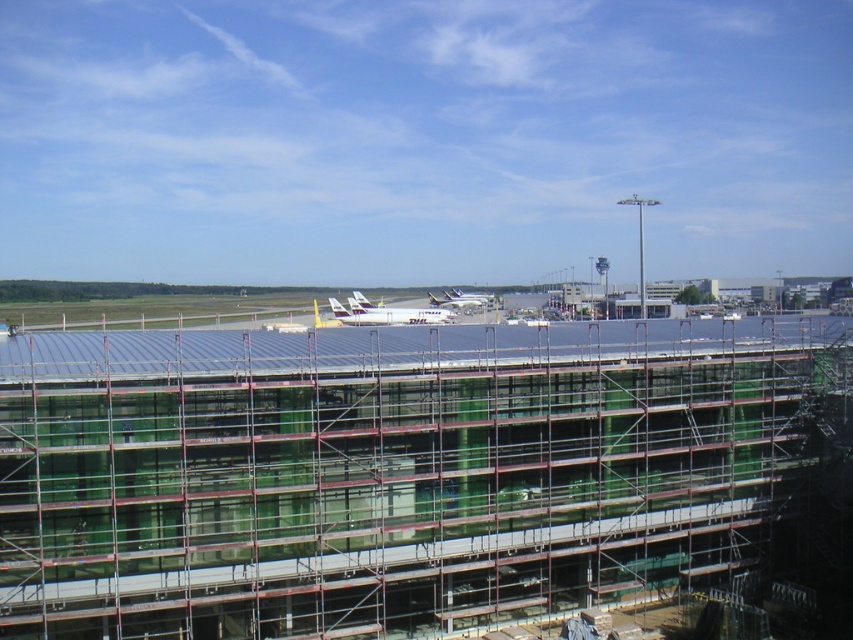
Question: Does green glass building at center have a smaller size compared to white matte airplane at center?

Choices:
 (A) no
 (B) yes

Answer: (A)

Question: Can you confirm if white matte airplane at center is positioned above white glossy airplane at center?

Choices:
 (A) yes
 (B) no

Answer: (B)

Question: Estimate the real-world distances between objects in this image. Which object is farther from the green glass building at center?

Choices:
 (A) white glossy airplane at center
 (B) white matte airplane at center

Answer: (A)

Question: Does green glass building at center have a smaller size compared to white glossy airplane at center?

Choices:
 (A) no
 (B) yes

Answer: (A)

Question: Which point appears closest to the camera in this image?

Choices:
 (A) (444, 301)
 (B) (668, 435)

Answer: (B)

Question: Considering the real-world distances, which object is farthest from the green glass building at center?

Choices:
 (A) white glossy airplane at center
 (B) white matte airplane at center

Answer: (A)